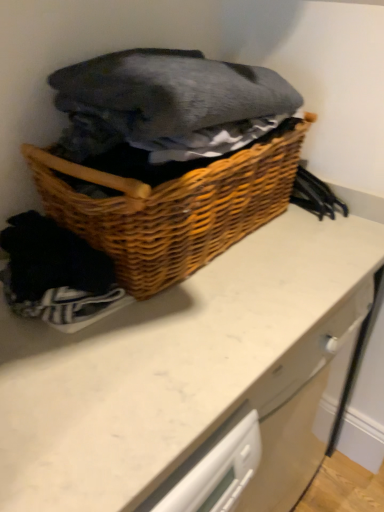
Where is `white marble counter at center`? Image resolution: width=384 pixels, height=512 pixels. white marble counter at center is located at coordinates (193, 371).

Find the location of a particular element. This screenshot has height=512, width=384. woven wood basket at center is located at coordinates (172, 208).

Describe the element at coordinates (168, 104) in the screenshot. This screenshot has width=384, height=512. I see `dark gray cotton blanket at upper center` at that location.

I want to click on white marble counter at center, so (x=193, y=371).

Considering the relative sizes of woven wood basket at center and dark gray cotton blanket at upper center in the image provided, is woven wood basket at center wider than dark gray cotton blanket at upper center?

Correct, the width of woven wood basket at center exceeds that of dark gray cotton blanket at upper center.

From a real-world perspective, which object stands above the other?

dark gray cotton blanket at upper center.

Locate an element on the screen. picnic basket on the right of dark gray cotton blanket at upper center is located at coordinates (172, 208).

Between woven wood basket at center and dark gray cotton blanket at upper center, which one has less height?

dark gray cotton blanket at upper center.

From the image's perspective, is dark gray cotton blanket at upper center located above woven wood basket at center?

Yes, from the image's perspective, dark gray cotton blanket at upper center is above woven wood basket at center.

From a real-world perspective, who is located higher, dark gray cotton blanket at upper center or woven wood basket at center?

dark gray cotton blanket at upper center.

Consider the image. Can you confirm if dark gray cotton blanket at upper center is thinner than woven wood basket at center?

Yes.

Does woven wood basket at center have a greater width compared to white marble counter at center?

Incorrect, the width of woven wood basket at center does not surpass that of white marble counter at center.

From the image's perspective, which is below, woven wood basket at center or white marble counter at center?

white marble counter at center appears lower in the image.

Who is bigger, woven wood basket at center or white marble counter at center?

white marble counter at center is bigger.

Is woven wood basket at center spatially inside white marble counter at center, or outside of it?

woven wood basket at center is spatially situated outside white marble counter at center.

From the image's perspective, which one is positioned lower, dark gray cotton blanket at upper center or white marble counter at center?

white marble counter at center, from the image's perspective.

Is dark gray cotton blanket at upper center positioned with its back to white marble counter at center?

dark gray cotton blanket at upper center does not have its back to white marble counter at center.

Considering the sizes of dark gray cotton blanket at upper center and white marble counter at center in the image, is dark gray cotton blanket at upper center taller or shorter than white marble counter at center?

Considering their sizes, dark gray cotton blanket at upper center has less height than white marble counter at center.

Does white marble counter at center touch woven wood basket at center?

No, white marble counter at center is not in contact with woven wood basket at center.

Is white marble counter at center turned away from woven wood basket at center?

No, white marble counter at center's orientation is not away from woven wood basket at center.

Is white marble counter at center situated inside woven wood basket at center or outside?

white marble counter at center cannot be found inside woven wood basket at center.

From a real-world perspective, is white marble counter at center above or below woven wood basket at center?

In terms of real-world spatial position, white marble counter at center is below woven wood basket at center.

How much distance is there between white marble counter at center and dark gray cotton blanket at upper center?

white marble counter at center and dark gray cotton blanket at upper center are 39.06 centimeters apart.

In the scene shown: Is white marble counter at center closer to camera compared to dark gray cotton blanket at upper center?

No.

What's the angular difference between white marble counter at center and dark gray cotton blanket at upper center's facing directions?

The facing directions of white marble counter at center and dark gray cotton blanket at upper center are 3.07 degrees apart.

The width and height of the screenshot is (384, 512). In order to click on clothing located above the white marble counter at center (from the image's perspective) in this screenshot , I will do `click(168, 104)`.

This screenshot has width=384, height=512. Identify the location of picnic basket directly beneath the dark gray cotton blanket at upper center (from a real-world perspective). (172, 208).

Locate an element on the screen. This screenshot has height=512, width=384. clothing that is on the left side of woven wood basket at center is located at coordinates (168, 104).

Which object lies further to the anchor point woven wood basket at center, dark gray cotton blanket at upper center or white marble counter at center?

white marble counter at center is further to woven wood basket at center.

Considering their positions, is white marble counter at center positioned closer to woven wood basket at center than dark gray cotton blanket at upper center?

The object closer to woven wood basket at center is dark gray cotton blanket at upper center.

Looking at the image, which one is located further to dark gray cotton blanket at upper center, woven wood basket at center or white marble counter at center?

white marble counter at center is positioned further to the anchor dark gray cotton blanket at upper center.

When comparing their distances from white marble counter at center, does woven wood basket at center or dark gray cotton blanket at upper center seem further?

dark gray cotton blanket at upper center is further to white marble counter at center.

Based on their spatial positions, is white marble counter at center or woven wood basket at center closer to dark gray cotton blanket at upper center?

Among the two, woven wood basket at center is located nearer to dark gray cotton blanket at upper center.

Looking at the image, which one is located further to white marble counter at center, dark gray cotton blanket at upper center or woven wood basket at center?

Based on the image, dark gray cotton blanket at upper center appears to be further to white marble counter at center.

You are a GUI agent. You are given a task and a screenshot of the screen. Output one action in this format:
    pyautogui.click(x=<x>, y=<y>)
    Task: Click on the picnic basket between dark gray cotton blanket at upper center and white marble counter at center vertically
    The height and width of the screenshot is (512, 384).
    Given the screenshot: What is the action you would take?
    pyautogui.click(x=172, y=208)